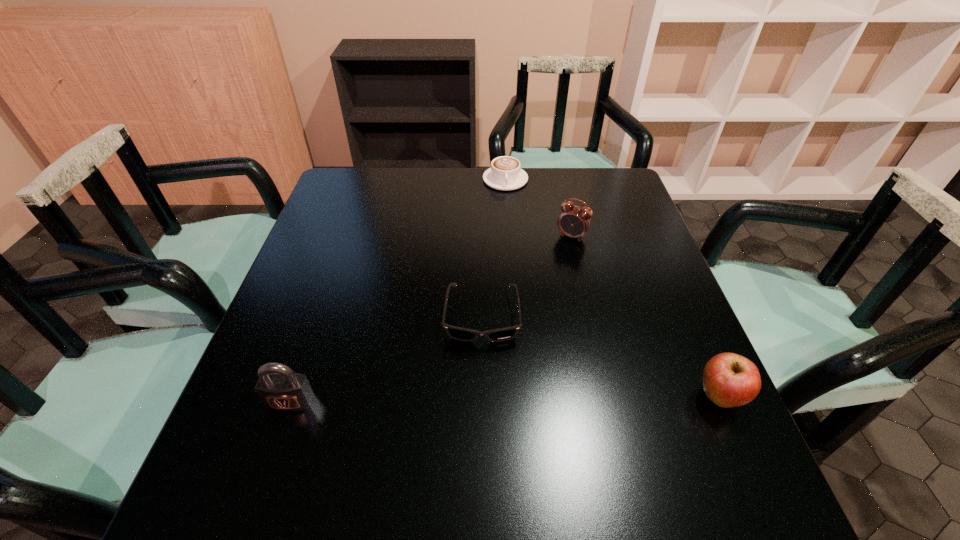
Image resolution: width=960 pixels, height=540 pixels. Identify the location of free space on the desktop that is between the leftmost object and the apple and is positioned on the face of the fourth nearest object. (467, 400).

Where is `vacant space on the desktop that is between the leftmost object and the rightmost object and is positioned on the front-facing side of the third nearest object`? This screenshot has height=540, width=960. vacant space on the desktop that is between the leftmost object and the rightmost object and is positioned on the front-facing side of the third nearest object is located at coordinates (480, 399).

The width and height of the screenshot is (960, 540). I want to click on vacant space on the desktop that is between the padlock and the rightmost object and is positioned with the handle on the right side of the farthest object, so click(564, 399).